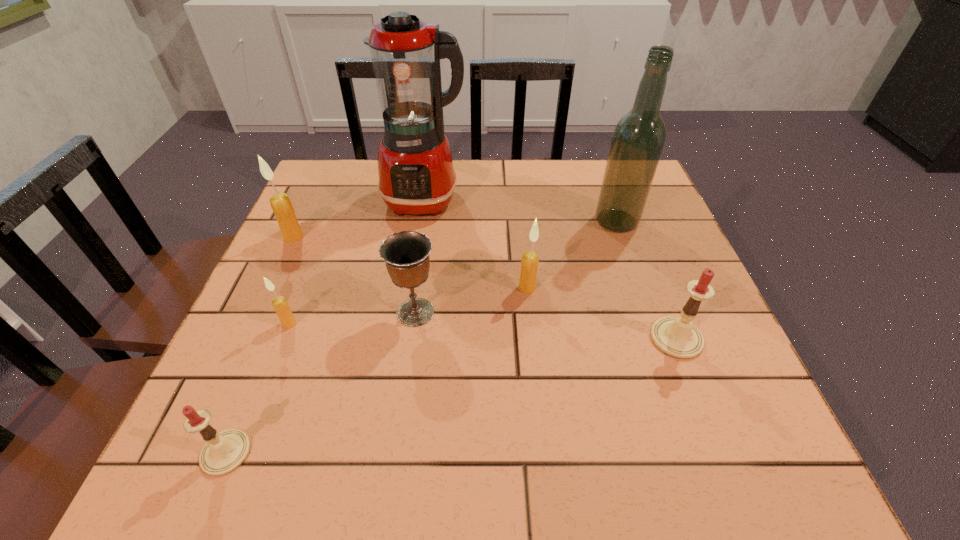
At what (x,y) coordinates should I click in order to perform the action: click on free spot that satisfies the following two spatial constraints: 1. on the back side of the green liquor; 2. on the right side of the nearer red candle. Please return your answer as a coordinate pair (x, y). This screenshot has width=960, height=540. Looking at the image, I should click on (322, 221).

Locate an element on the screen. This screenshot has height=540, width=960. vacant space that satisfies the following two spatial constraints: 1. on the controls of the food processor; 2. on the right side of the liquor is located at coordinates (421, 221).